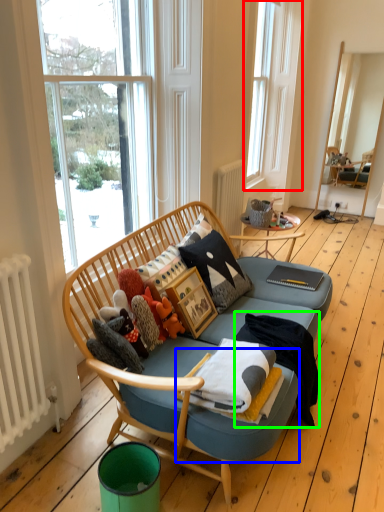
Question: Based on their relative distances, which object is nearer to window (highlighted by a red box)? Choose from footrest (highlighted by a blue box) and blanket (highlighted by a green box).

Choices:
 (A) footrest
 (B) blanket

Answer: (B)